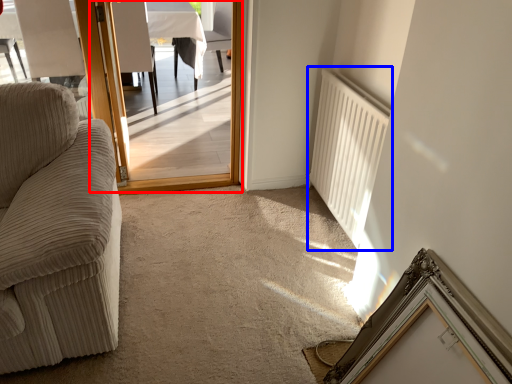
Question: Which point is further to the camera, screen door (highlighted by a red box) or radiator (highlighted by a blue box)?

Choices:
 (A) screen door
 (B) radiator

Answer: (A)